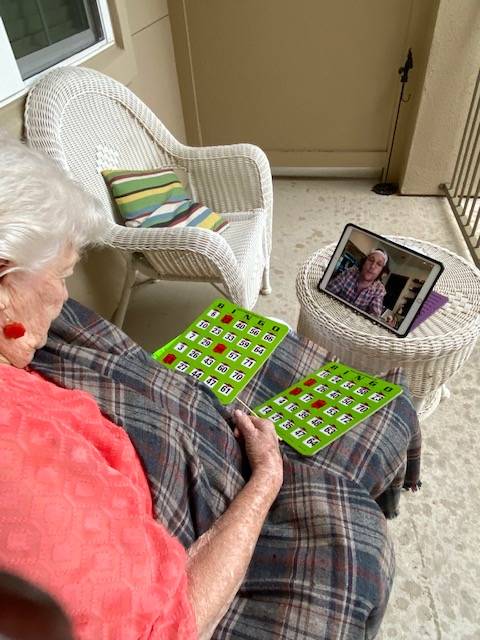
What are the coordinates of `white wicker table` in the screenshot? It's located at (427, 351).